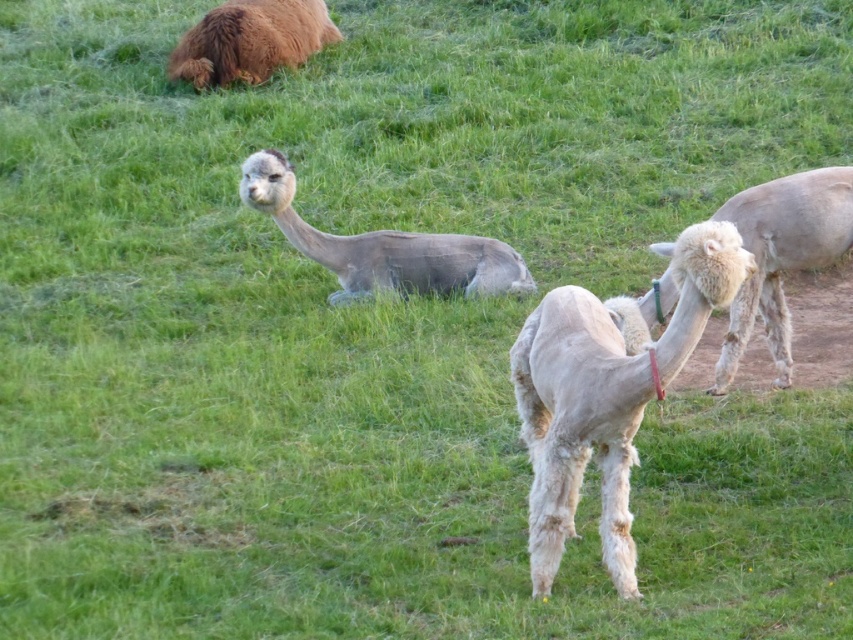
You are a photographer trying to capture a photo of the white woolen camel at right and the brown fluffy camel at upper left. Based on their positions, which camel should you focus on first if you want to include both in your shot without moving the camera?

You should focus on the brown fluffy camel at upper left first because the white woolen camel at right is to the right of it, so adjusting the camera frame to include both would require ensuring the leftmost camel is within the shot first.

You are a photographer trying to capture a photo of the white woolen camel at center and the brown fluffy camel at upper left. Based on their positions, which camel is closer to the camera?

The white woolen camel at center is closer to the camera because it is located below the brown fluffy camel at upper left, indicating it is in a lower position in the image plane which typically corresponds to being nearer to the viewer.

You are a farmer who wants to build a fence around the field where the fuzzy gray alpaca at center and the brown fluffy camel at upper left are grazing. Considering their sizes, which animal requires a taller fence to ensure it can move comfortably?

The brown fluffy camel at upper left requires a taller fence because the fuzzy gray alpaca at center is not as tall as it.